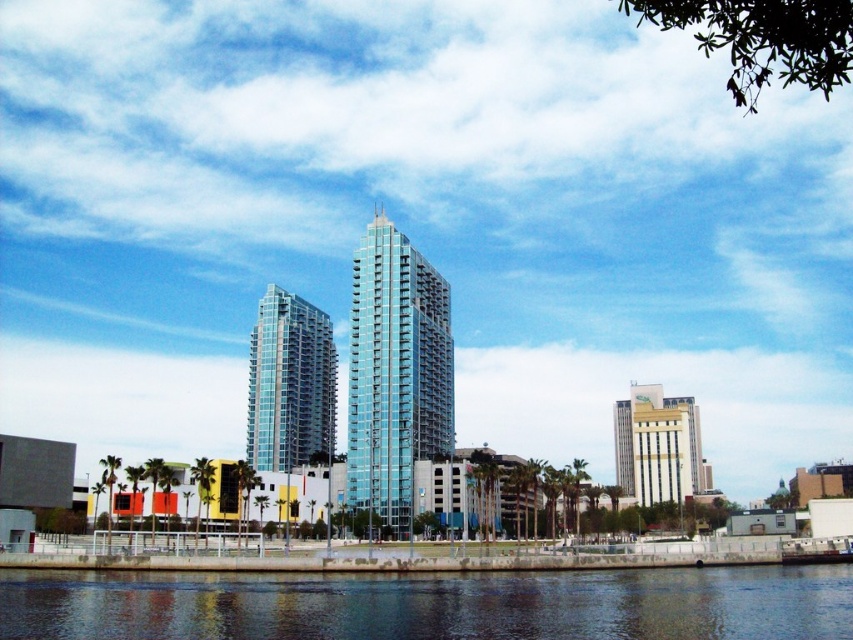
Is the position of dark blue water at lower center less distant than that of gold/golden metallic building at center-right?

Yes, it is in front of gold/golden metallic building at center-right.

Measure the distance from dark blue water at lower center to gold/golden metallic building at center-right.

dark blue water at lower center and gold/golden metallic building at center-right are 109.64 meters apart.

Find the location of `dark blue water at lower center`. dark blue water at lower center is located at coordinates coord(432,604).

This screenshot has width=853, height=640. Find the location of `dark blue water at lower center`. dark blue water at lower center is located at coordinates (432, 604).

Who is more distant from viewer, [270,355] or [662,442]?

Positioned behind is point [662,442].

Is shiny glass skyscraper at center shorter than gold/golden metallic building at center-right?

In fact, shiny glass skyscraper at center may be taller than gold/golden metallic building at center-right.

Does point (281, 429) come behind point (670, 404)?

No.

You are a GUI agent. You are given a task and a screenshot of the screen. Output one action in this format:
    pyautogui.click(x=<x>, y=<y>)
    Task: Click on the shiny glass skyscraper at center
    
    Given the screenshot: What is the action you would take?
    pyautogui.click(x=289, y=384)

Identify the location of transparent glass building at center. (x=395, y=372).

Find the location of a particular element. transparent glass building at center is located at coordinates (395, 372).

At what (x,y) coordinates should I click in order to perform the action: click on transparent glass building at center. Please return your answer as a coordinate pair (x, y). Looking at the image, I should click on point(395,372).